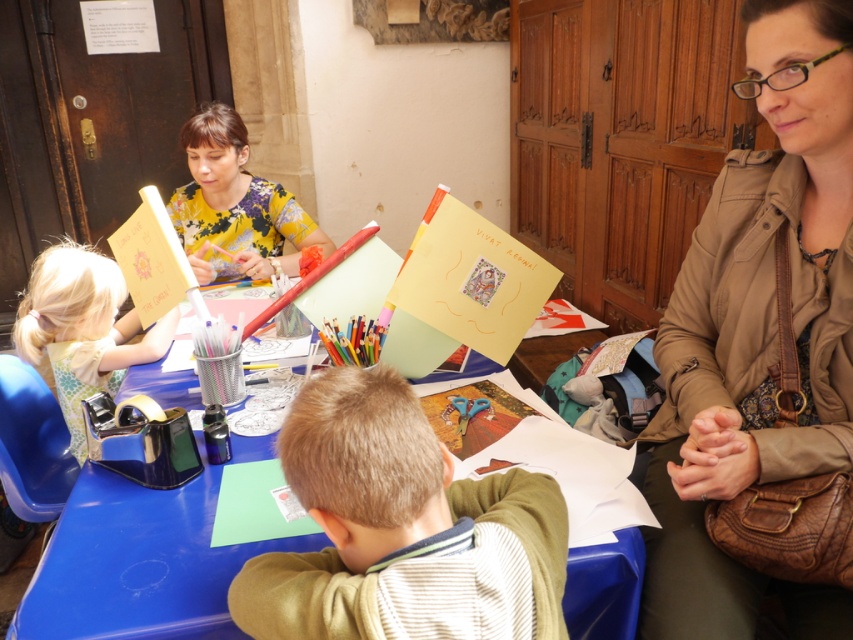
You are a photographer trying to capture a closeup of the blue plastic table at center without including the light brown hair at center in the frame. Is this possible given their positions?

The light brown hair at center is in front of the blue plastic table at center, so it would block the view. Therefore, capturing a closeup of the blue plastic table at center without including the light brown hair at center is not possible.

You are a teacher observing the craft activity. You need to ensure that the child with light brown hair at center maintains a safe distance of at least 12 inches from the blue plastic table at center. Is the current distance sufficient?

The distance between the light brown hair at center and the blue plastic table at center is 12.10 inches, which meets the requirement of at least 12 inches, so the current distance is sufficient.